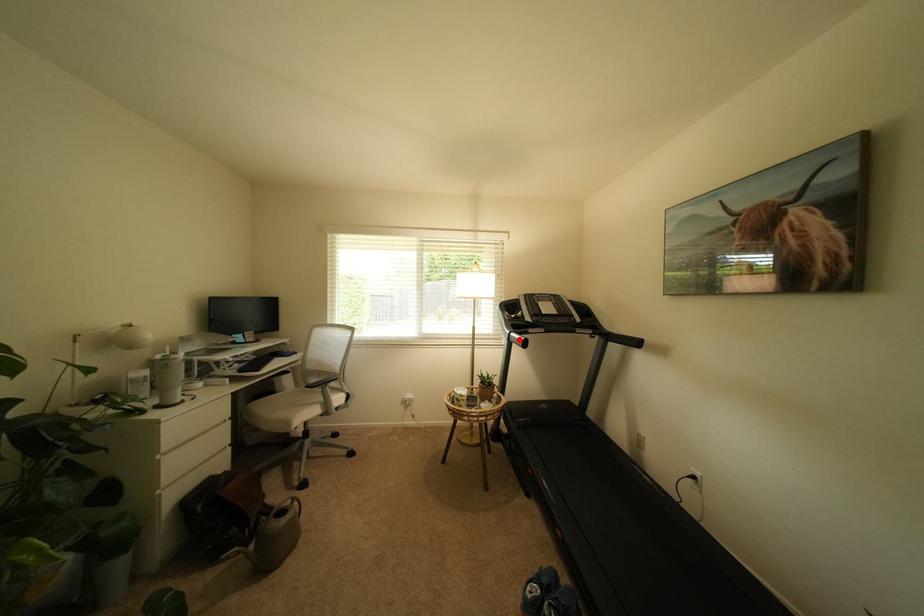
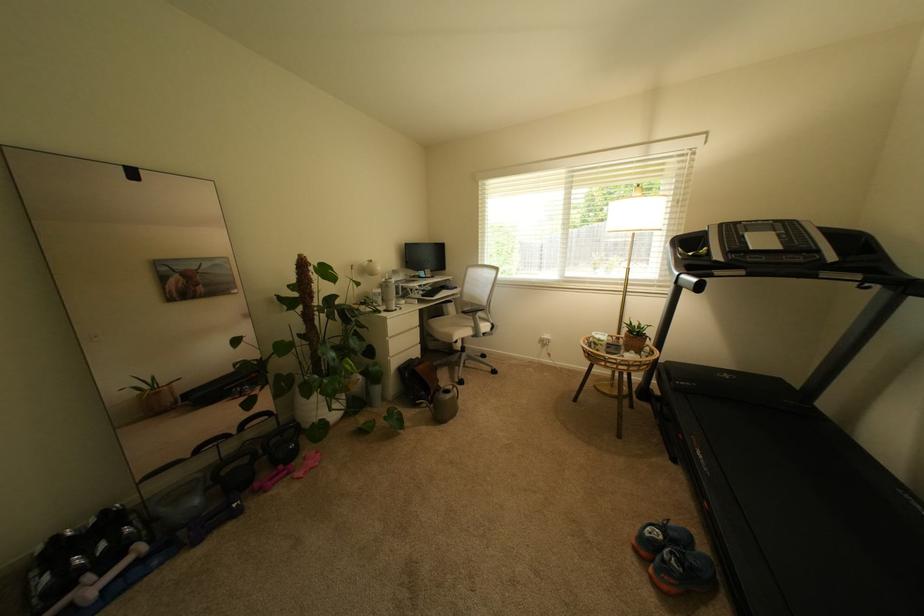
In the second image, find the point that corresponds to the highlighted location in the first image.

(688, 283)